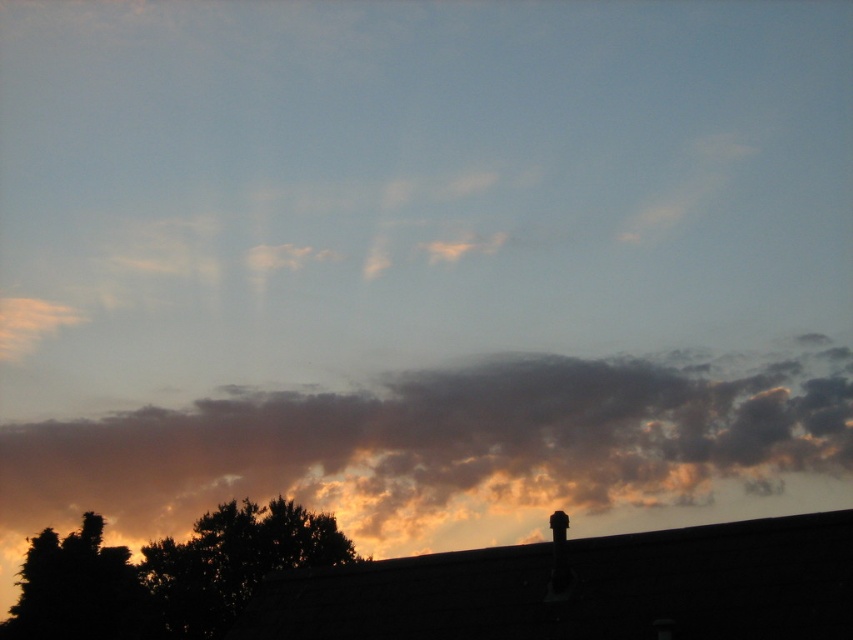
Question: Can you confirm if orange-hued cotton cloud at center is thinner than dark green leafy tree at lower left?

Choices:
 (A) yes
 (B) no

Answer: (B)

Question: Which object is positioned farthest from the orange-hued cotton cloud at center?

Choices:
 (A) silhouette leafy tree at lower left
 (B) dark green leafy tree at lower left

Answer: (A)

Question: Which object is farther from the camera taking this photo?

Choices:
 (A) silhouette leafy tree at lower left
 (B) dark green leafy tree at lower left
 (C) orange-hued cotton cloud at center

Answer: (C)

Question: Where is silhouette leafy tree at lower left located in relation to dark green leafy tree at lower left in the image?

Choices:
 (A) below
 (B) above

Answer: (B)

Question: Which point appears farthest from the camera in this image?

Choices:
 (A) (308, 481)
 (B) (12, 636)

Answer: (A)

Question: Does orange-hued cotton cloud at center have a larger size compared to dark green leafy tree at lower left?

Choices:
 (A) no
 (B) yes

Answer: (B)